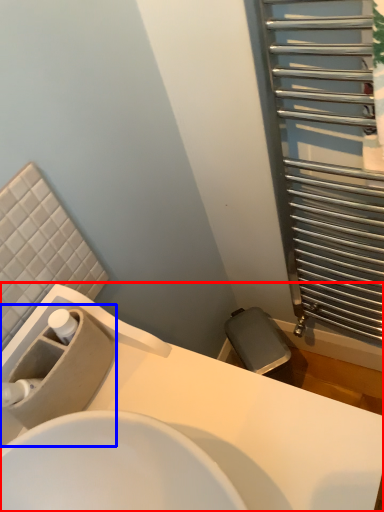
Question: Which of the following is the closest to the observer, sink (highlighted by a red box) or sink (highlighted by a blue box)?

Choices:
 (A) sink
 (B) sink

Answer: (A)